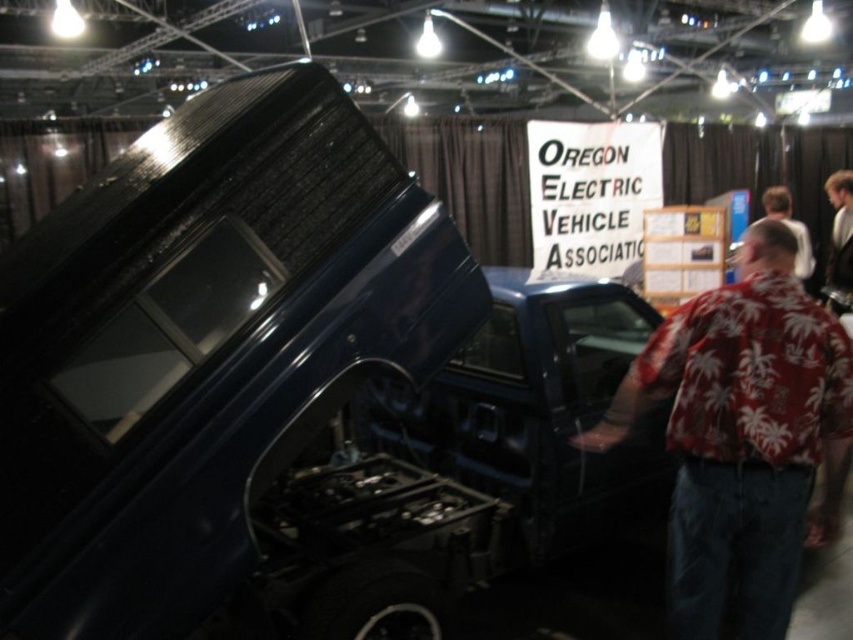
Is point (4, 467) more distant than point (781, 214)?

No, (4, 467) is closer to viewer.

Consider the image. Can you confirm if glossy blue truck at center is positioned to the left of red floral shirt at center?

Yes, glossy blue truck at center is to the left of red floral shirt at center.

Who is more distant from viewer, (219, 124) or (780, 209)?

The point (780, 209) is behind.

You are a GUI agent. You are given a task and a screenshot of the screen. Output one action in this format:
    pyautogui.click(x=<x>, y=<y>)
    Task: Click on the glossy blue truck at center
    
    Given the screenshot: What is the action you would take?
    pyautogui.click(x=231, y=385)

Is glossy blue truck at center taller than white shirt at right?

Yes.

Does glossy blue truck at center come behind white shirt at right?

No, glossy blue truck at center is in front of white shirt at right.

Is point (395, 576) farther from viewer compared to point (833, 177)?

That is False.

Image resolution: width=853 pixels, height=640 pixels. What are the coordinates of `glossy blue truck at center` in the screenshot? It's located at (231, 385).

Does white paper sign at upper center appear under red floral shirt at center?

Incorrect, white paper sign at upper center is not positioned below red floral shirt at center.

Is white paper sign at upper center closer to the viewer compared to red floral shirt at center?

No, white paper sign at upper center is further to the viewer.

Describe the element at coordinates (590, 193) in the screenshot. I see `white paper sign at upper center` at that location.

Locate an element on the screen. Image resolution: width=853 pixels, height=640 pixels. white paper sign at upper center is located at coordinates (590, 193).